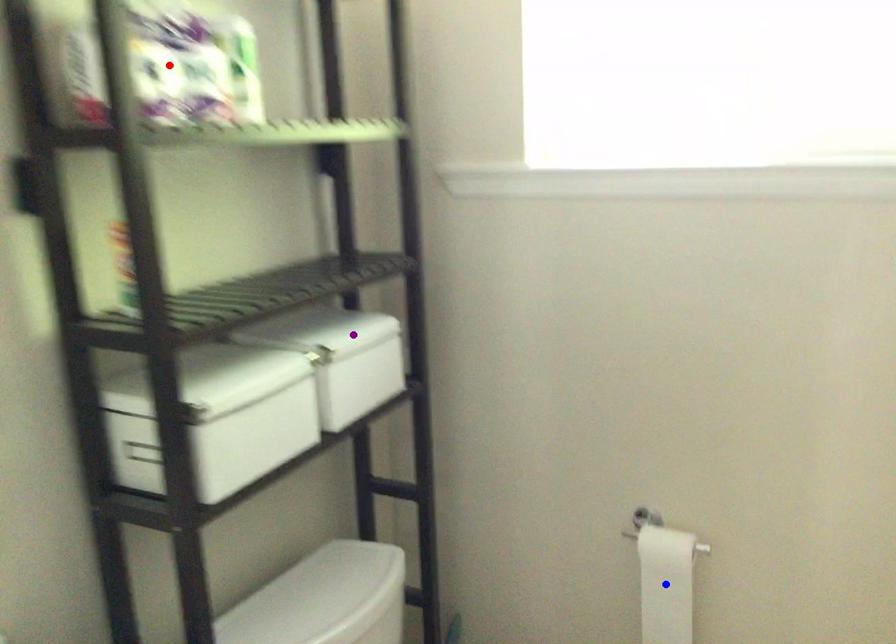
Order these from nearest to farthest:
A) red point
B) blue point
C) purple point

red point
purple point
blue point